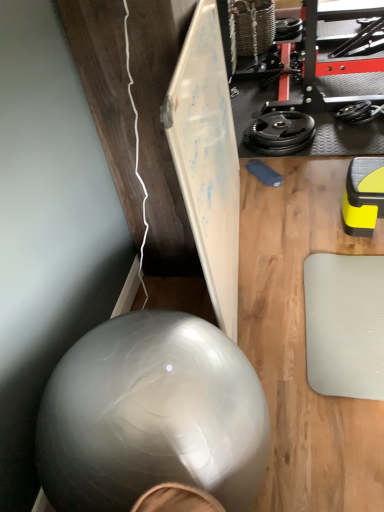
Question: Based on their positions, is transparent rubber ball at lower left located to the left or right of black rubber weight at upper right?

Choices:
 (A) left
 (B) right

Answer: (A)

Question: Considering the positions of transparent rubber ball at lower left and black rubber weight at upper right in the image, is transparent rubber ball at lower left bigger or smaller than black rubber weight at upper right?

Choices:
 (A) big
 (B) small

Answer: (A)

Question: From their relative heights in the image, would you say transparent rubber ball at lower left is taller or shorter than black rubber weight at upper right?

Choices:
 (A) tall
 (B) short

Answer: (A)

Question: From their relative heights in the image, would you say black rubber weight at upper right is taller or shorter than transparent rubber ball at lower left?

Choices:
 (A) short
 (B) tall

Answer: (A)

Question: Looking at the image, does black rubber weight at upper right seem bigger or smaller compared to transparent rubber ball at lower left?

Choices:
 (A) small
 (B) big

Answer: (A)

Question: Considering the positions of black rubber weight at upper right and transparent rubber ball at lower left in the image, is black rubber weight at upper right wider or thinner than transparent rubber ball at lower left?

Choices:
 (A) thin
 (B) wide

Answer: (A)

Question: From the image's perspective, is black rubber weight at upper right above or below transparent rubber ball at lower left?

Choices:
 (A) below
 (B) above

Answer: (B)